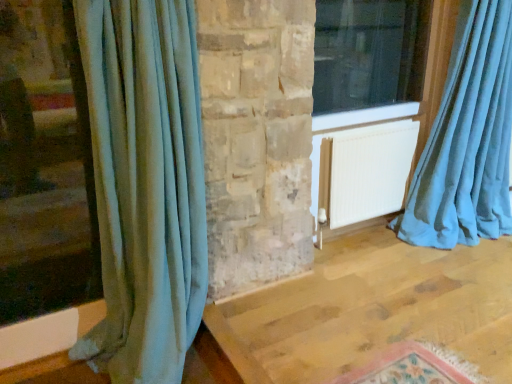
Locate an element on the screen. The image size is (512, 384). blank space above white matte radiator at center (from a real-world perspective) is located at coordinates (368, 124).